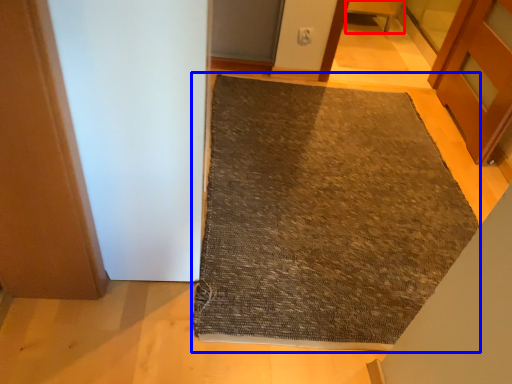
Question: Among these objects, which one is farthest to the camera, furniture (highlighted by a red box) or mat (highlighted by a blue box)?

Choices:
 (A) furniture
 (B) mat

Answer: (A)